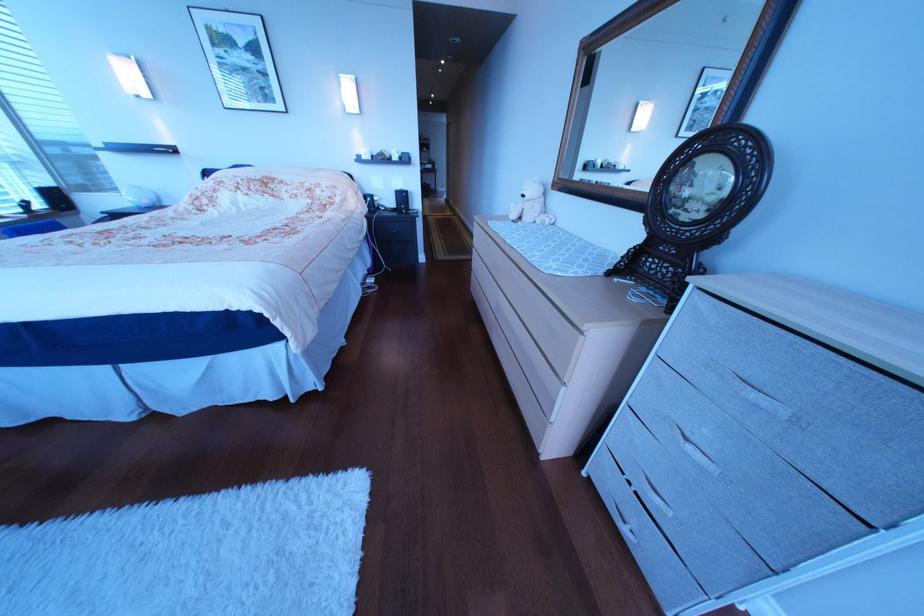
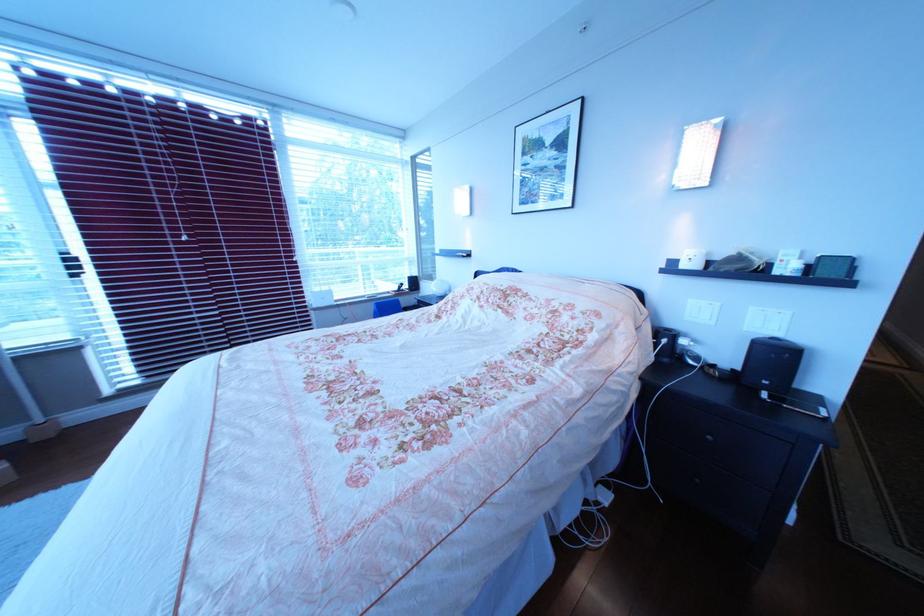
Where in the second image is the point corresponding to point 397,209 from the first image?

(707, 363)